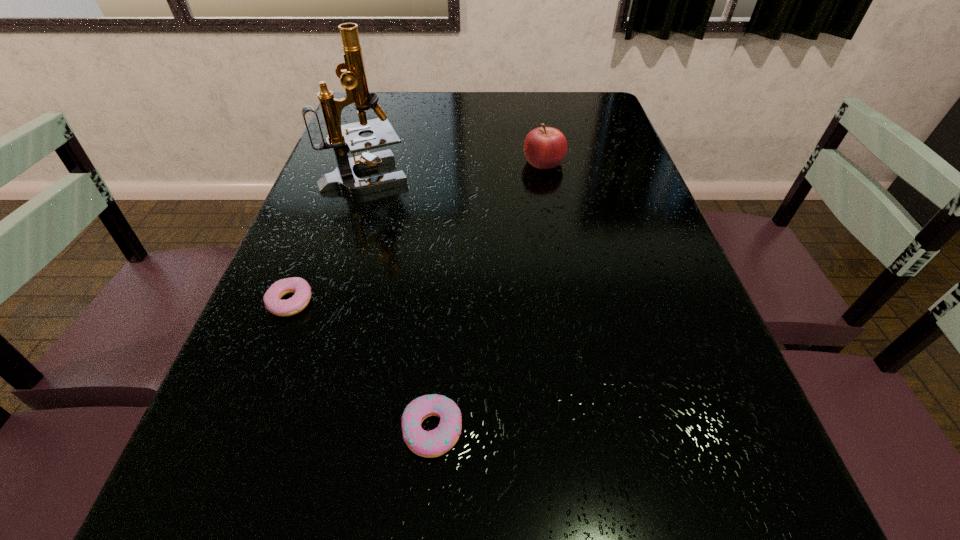
You are a GUI agent. You are given a task and a screenshot of the screen. Output one action in this format:
    pyautogui.click(x=<x>, y=<y>)
    Task: Click on the tallest object
    The width and height of the screenshot is (960, 540).
    Given the screenshot: What is the action you would take?
    pyautogui.click(x=342, y=138)

Locate an element on the screen. The width and height of the screenshot is (960, 540). apple is located at coordinates (545, 147).

Locate an element on the screen. Image resolution: width=960 pixels, height=540 pixels. the rightmost object is located at coordinates [x=545, y=147].

Where is `the nearest object`? The height and width of the screenshot is (540, 960). the nearest object is located at coordinates (434, 443).

The image size is (960, 540). In order to click on the nearer doughnut in this screenshot , I will do `click(434, 443)`.

The width and height of the screenshot is (960, 540). I want to click on the third farthest object, so click(302, 291).

The height and width of the screenshot is (540, 960). I want to click on the left doughnut, so click(x=302, y=291).

You are a GUI agent. You are given a task and a screenshot of the screen. Output one action in this format:
    pyautogui.click(x=<x>, y=<y>)
    Task: Click on the vacant area situated 0.240m at the eyepiece of the microscope
    Image resolution: width=960 pixels, height=540 pixels.
    Given the screenshot: What is the action you would take?
    pyautogui.click(x=499, y=175)

You are a GUI agent. You are given a task and a screenshot of the screen. Output one action in this format:
    pyautogui.click(x=<x>, y=<y>)
    Task: Click on the blank area located on the back of the apple
    The image size is (960, 540).
    Given the screenshot: What is the action you would take?
    pyautogui.click(x=538, y=130)

Find the location of `blank space located 0.250m on the left of the nearest object`. blank space located 0.250m on the left of the nearest object is located at coordinates (242, 429).